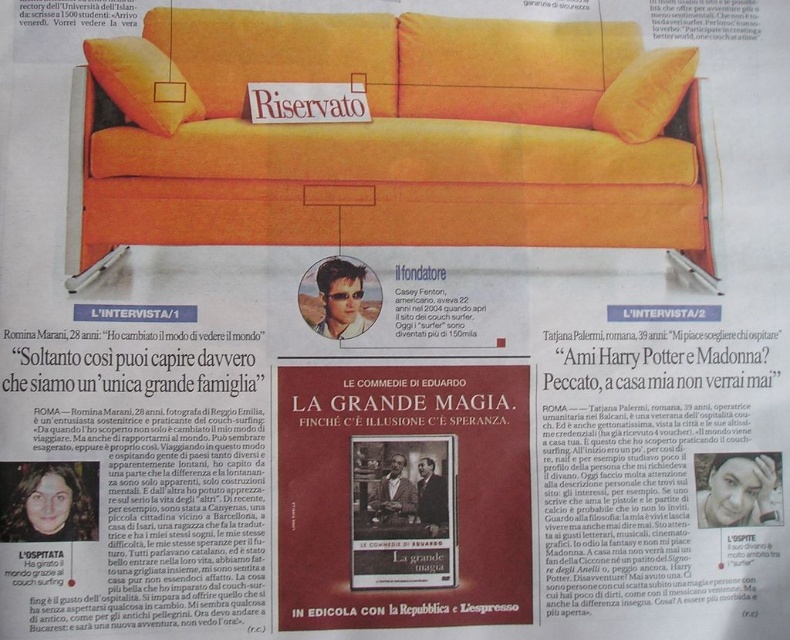
Based on the photo, where is the orange fabric couch at upper center located in the image?

The orange fabric couch at upper center is located at point (386,136).

You are a photographer standing at the camera position. You want to place a small tripod between yourself and the orange fabric couch at upper center. The tripod requires 24 inches of space to set up. Is there enough space for the tripod?

The orange fabric couch at upper center is 33.67 inches from the camera, so there is sufficient space to place the tripod between the photographer and the couch since 33.67 inches is more than the required 24 inches.

You are designing a living room layout and have placed the matte orange pillow at upper left and the orange fabric pillow at upper right on a shelf. If you want to ensure both pillows fit within a 1.2 meter wide shelf, what should you consider?

You should consider the combined width of the matte orange pillow at upper left and orange fabric pillow at upper right. Since the matte orange pillow at upper left might be wider than the orange fabric pillow at upper right, you need to check if their total width stays under 1.2 meters.